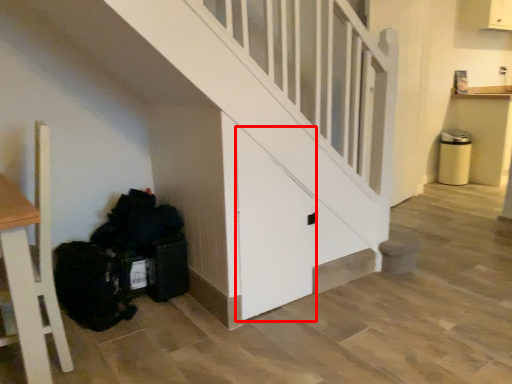
Question: Observing the image, what is the correct spatial positioning of door (annotated by the red box) in reference to garbage?

Choices:
 (A) right
 (B) left

Answer: (A)